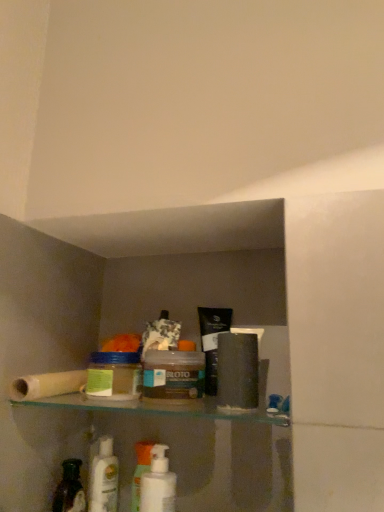
Question: In which direction should I rotate to look at matte brown jar at center, which is the first product in right-to-left order?

Choices:
 (A) left
 (B) right

Answer: (A)

Question: Is translucent plastic jar at center, acting as the second product starting from the right, thinner than matte brown jar at center, which is the first product in right-to-left order?

Choices:
 (A) no
 (B) yes

Answer: (B)

Question: Does translucent plastic jar at center, acting as the second product starting from the right, lie behind matte brown jar at center, which is the first product in right-to-left order?

Choices:
 (A) yes
 (B) no

Answer: (A)

Question: Can you confirm if translucent plastic jar at center, the first product viewed from the left, is smaller than matte brown jar at center, the 2th product from the left?

Choices:
 (A) yes
 (B) no

Answer: (A)

Question: Can we say translucent plastic jar at center, the first product viewed from the left, lies outside matte brown jar at center, which is the first product in right-to-left order?

Choices:
 (A) yes
 (B) no

Answer: (A)

Question: From the image's perspective, is translucent plastic jar at center, acting as the second product starting from the right, above matte brown jar at center, the 2th product from the left?

Choices:
 (A) no
 (B) yes

Answer: (B)

Question: Are translucent plastic jar at center, the first product viewed from the left, and matte brown jar at center, which is the first product in right-to-left order, beside each other?

Choices:
 (A) no
 (B) yes

Answer: (B)

Question: Is translucent plastic bottle at lower left shorter than matte brown jar at center, the 2th product from the left?

Choices:
 (A) no
 (B) yes

Answer: (A)

Question: Considering the relative sizes of translucent plastic bottle at lower left and matte brown jar at center, the 2th product from the left, in the image provided, is translucent plastic bottle at lower left wider than matte brown jar at center, the 2th product from the left,?

Choices:
 (A) yes
 (B) no

Answer: (B)

Question: From the image's perspective, is translucent plastic bottle at lower left beneath matte brown jar at center, the 2th product from the left?

Choices:
 (A) yes
 (B) no

Answer: (A)

Question: Is translucent plastic bottle at lower left not close to matte brown jar at center, which is the first product in right-to-left order?

Choices:
 (A) yes
 (B) no

Answer: (B)

Question: Can you see translucent plastic bottle at lower left touching matte brown jar at center, the 2th product from the left?

Choices:
 (A) no
 (B) yes

Answer: (A)

Question: From the image's perspective, is translucent plastic bottle at lower left located above matte brown jar at center, which is the first product in right-to-left order?

Choices:
 (A) yes
 (B) no

Answer: (B)

Question: Can you see translucent plastic roll at left touching white plastic mouthwash at center, which appears as the 2th mouthwash when viewed from the left?

Choices:
 (A) yes
 (B) no

Answer: (B)